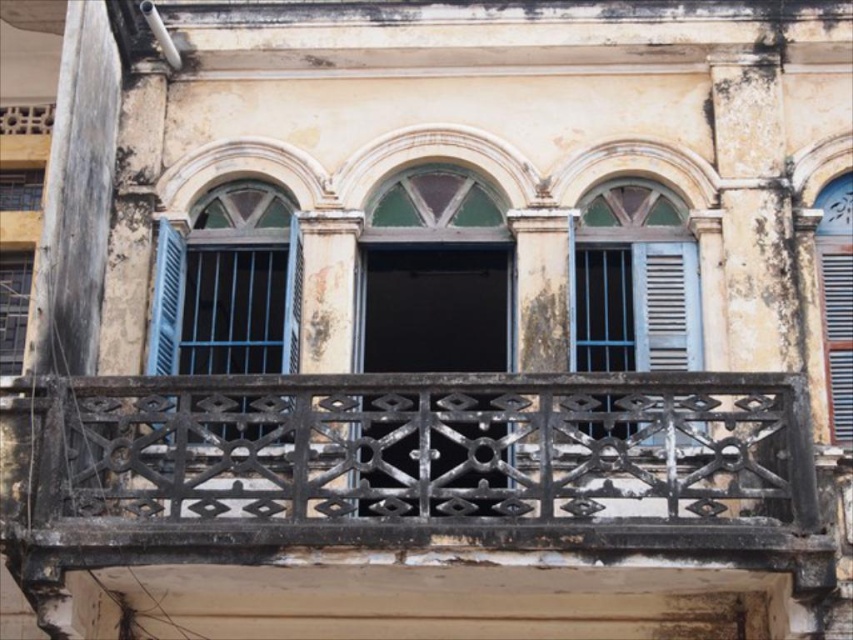
Question: Observing the image, what is the correct spatial positioning of black wrought iron at center in reference to green glass window at center?

Choices:
 (A) above
 (B) below

Answer: (B)

Question: Does matte blue wooden window at center come in front of blue wooden window at center?

Choices:
 (A) no
 (B) yes

Answer: (B)

Question: Among these objects, which one is farthest from the camera?

Choices:
 (A) matte blue wooden window at center
 (B) black wrought iron at center

Answer: (A)

Question: From the image, what is the correct spatial relationship of green glass window at center in relation to blue wooden window at center?

Choices:
 (A) below
 (B) above

Answer: (A)

Question: Which point is farther to the camera?

Choices:
 (A) (428, 300)
 (B) (213, 241)
 (C) (840, 241)
 (D) (660, 456)

Answer: (A)

Question: Which point appears closest to the camera in this image?

Choices:
 (A) pyautogui.click(x=386, y=324)
 (B) pyautogui.click(x=822, y=307)

Answer: (B)